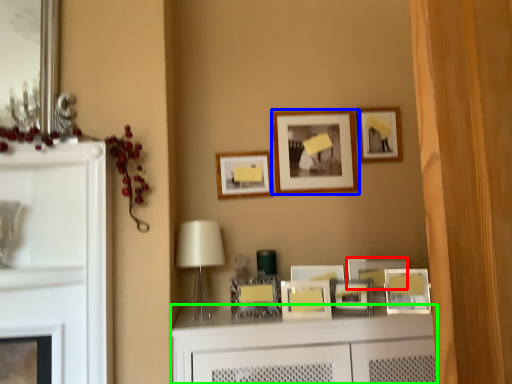
Question: Which object is positioned farthest from picture frame (highlighted by a red box)? Select from picture frame (highlighted by a blue box) and vanity (highlighted by a green box).

Choices:
 (A) picture frame
 (B) vanity

Answer: (A)